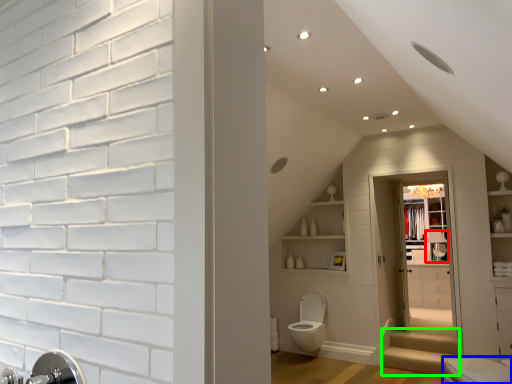
Question: Which is nearer to the faucet (highlighted by a red box)? toilet (highlighted by a blue box) or stairwell (highlighted by a green box).

Choices:
 (A) toilet
 (B) stairwell

Answer: (B)